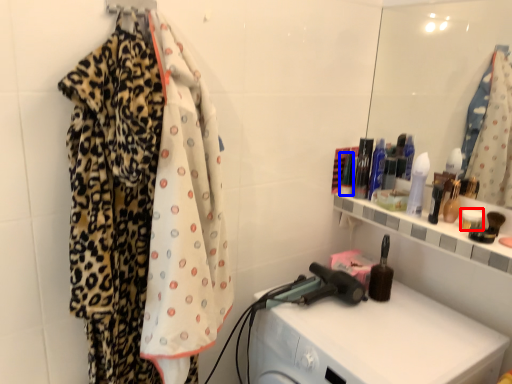
Question: Which of the following is the closest to the observer, toiletry (highlighted by a red box) or toiletry (highlighted by a blue box)?

Choices:
 (A) toiletry
 (B) toiletry

Answer: (A)